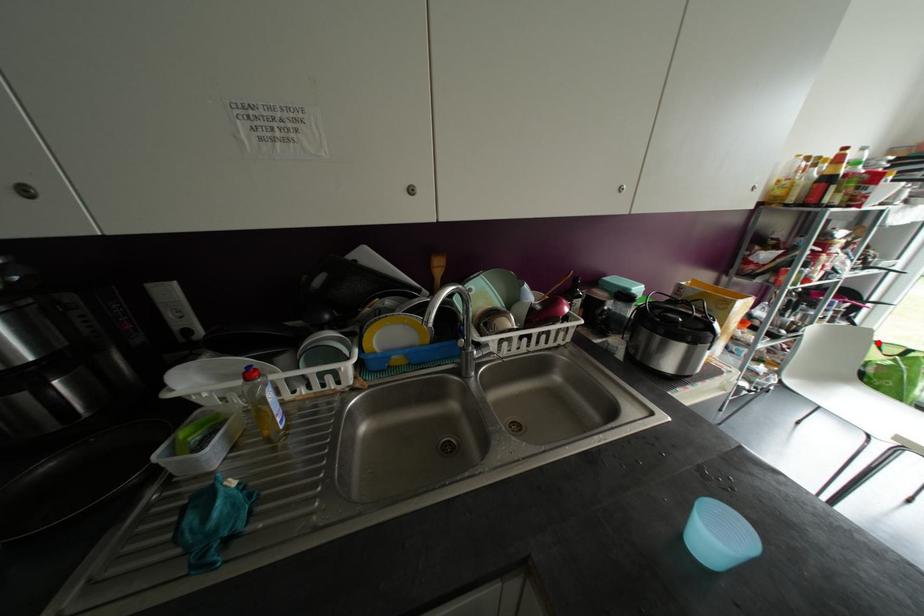
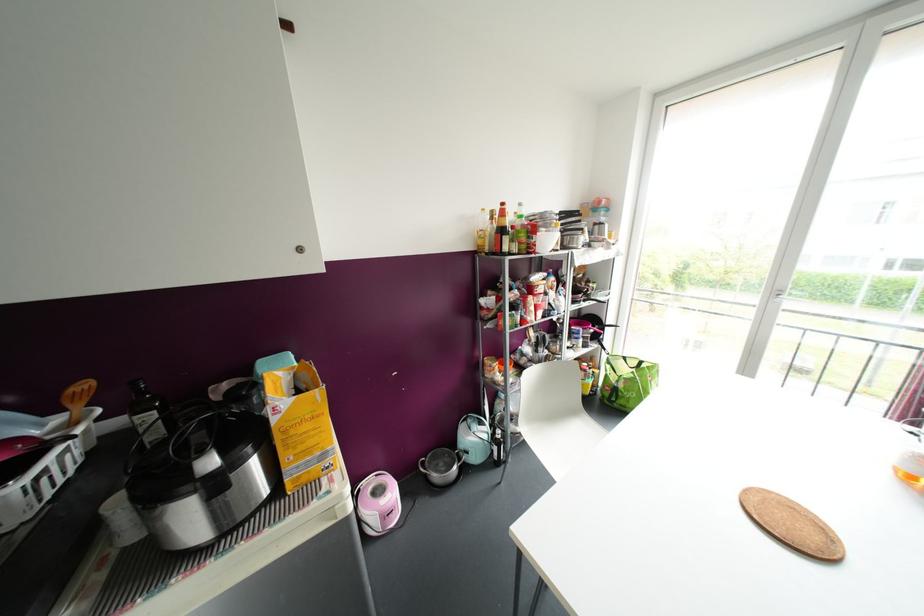
Question: I am providing you with two images of the same scene from different viewpoints. In image1, a red point is highlighted. Considering the same 3D point in image2, which of the following is correct?

Choices:
 (A) It is closer
 (B) It is farther

Answer: (B)